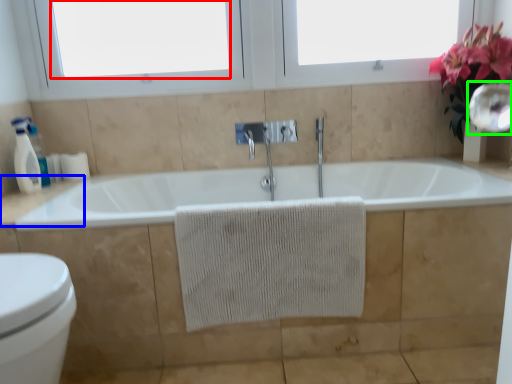
Question: Based on their relative distances, which object is nearer to window screen (highlighted by a red box)? Choose from counter top (highlighted by a blue box) and mirror (highlighted by a green box).

Choices:
 (A) counter top
 (B) mirror

Answer: (A)